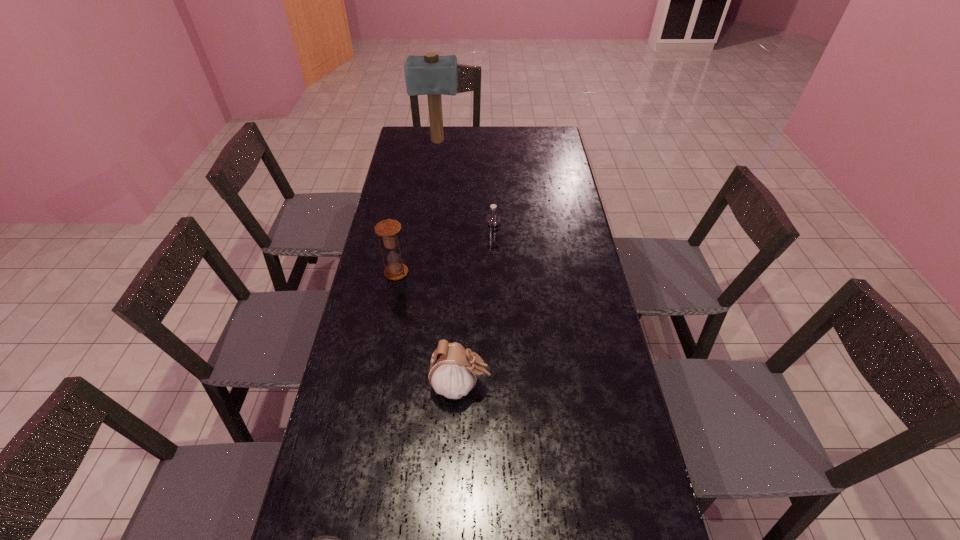
The image size is (960, 540). Find the location of `mallet`. mallet is located at coordinates (432, 75).

The height and width of the screenshot is (540, 960). I want to click on the farthest object, so click(x=432, y=75).

Identify the location of hourglass. (388, 229).

Locate an element on the screen. This screenshot has width=960, height=540. vodka is located at coordinates (492, 221).

This screenshot has height=540, width=960. Find the location of `the fourth farthest object`. the fourth farthest object is located at coordinates pyautogui.click(x=453, y=370).

In order to click on free space located on the back of the mallet in this screenshot , I will do `click(439, 129)`.

Where is `blank space located 0.140m on the front of the hourglass`? This screenshot has height=540, width=960. blank space located 0.140m on the front of the hourglass is located at coordinates (389, 315).

At what (x,y) coordinates should I click in order to perform the action: click on blank space located on the front label of the fourth nearest object. Please return your answer as a coordinate pair (x, y). Image resolution: width=960 pixels, height=540 pixels. Looking at the image, I should click on (494, 332).

Where is `vacant area situated 0.180m on the front-facing side of the pouch`? Image resolution: width=960 pixels, height=540 pixels. vacant area situated 0.180m on the front-facing side of the pouch is located at coordinates coord(558,386).

Find the location of a particular element. This screenshot has width=960, height=540. object at the far edge is located at coordinates tap(432, 75).